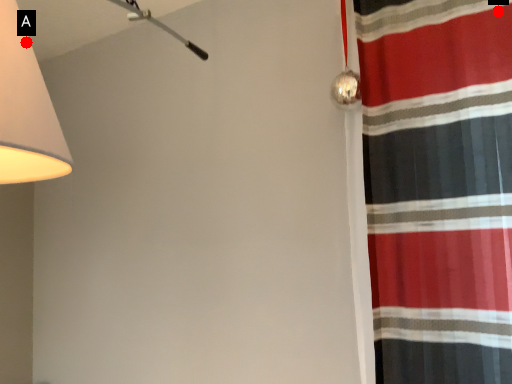
Question: Two points are circled on the image, labeled by A and B beside each circle. Among these points, which one is nearest to the camera?

Choices:
 (A) A is closer
 (B) B is closer

Answer: (A)